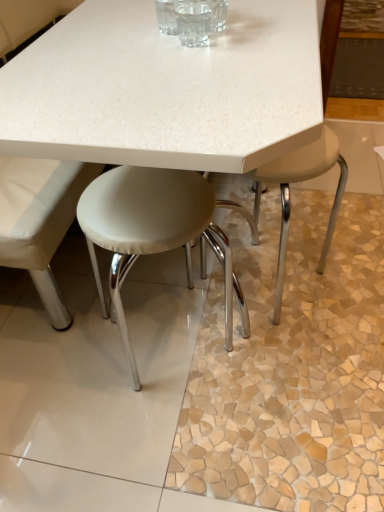
The image size is (384, 512). What are the coordinates of `vacant area situated below beige leather stool at lower right, acting as the second stool starting from the left (from a real-world perspective)` in the screenshot? It's located at (308, 310).